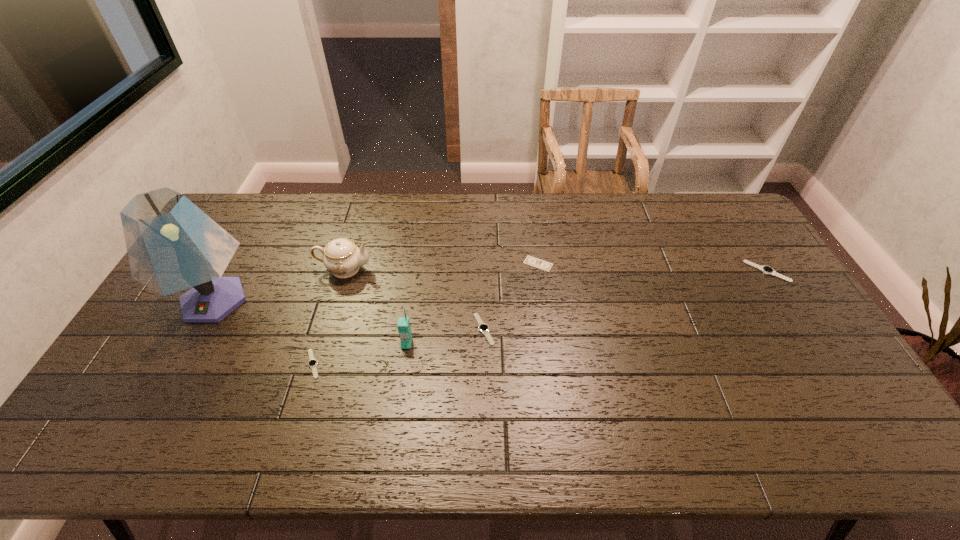
Locate an element on the screen. This screenshot has height=540, width=960. object located at the right edge is located at coordinates (767, 270).

Where is `vacant space at the far edge`? This screenshot has width=960, height=540. vacant space at the far edge is located at coordinates (274, 209).

Where is `blank space at the near edge of the desktop`? blank space at the near edge of the desktop is located at coordinates (657, 400).

You are a GUI agent. You are given a task and a screenshot of the screen. Output one action in this format:
    pyautogui.click(x=<x>, y=<y>)
    Task: Click on the vacant space at the left edge of the desktop
    This screenshot has width=960, height=540.
    Given the screenshot: What is the action you would take?
    pyautogui.click(x=183, y=353)

At what (x,y) coordinates should I click in order to perform the action: click on vacant space at the right edge. Please return your answer as a coordinate pair (x, y). Image resolution: width=960 pixels, height=540 pixels. Looking at the image, I should click on click(x=799, y=306).

The height and width of the screenshot is (540, 960). Identify the location of vacant space at the far right corner of the desktop. (724, 220).

Identify the location of empty space between the rightmost object and the sixth tallest object. The image size is (960, 540). (540, 318).

Image resolution: width=960 pixels, height=540 pixels. In order to click on free area in between the cellular telephone and the tallest watch in this screenshot , I will do `click(587, 307)`.

Where is `free spot between the money and the tallest watch`? This screenshot has height=540, width=960. free spot between the money and the tallest watch is located at coordinates (653, 267).

Identify the location of free area in between the cellular telephone and the leftmost watch. The height and width of the screenshot is (540, 960). (360, 354).